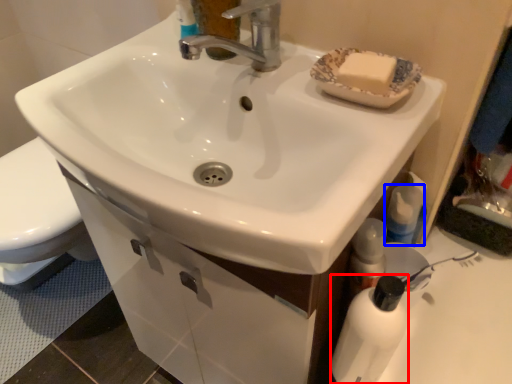
Question: Which of the following is the farthest to the observer, bottle (highlighted by a red box) or mouthwash (highlighted by a blue box)?

Choices:
 (A) bottle
 (B) mouthwash

Answer: (B)